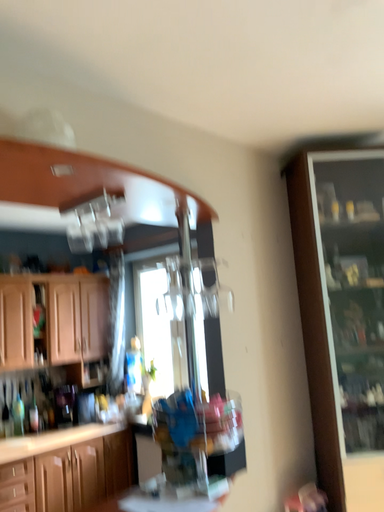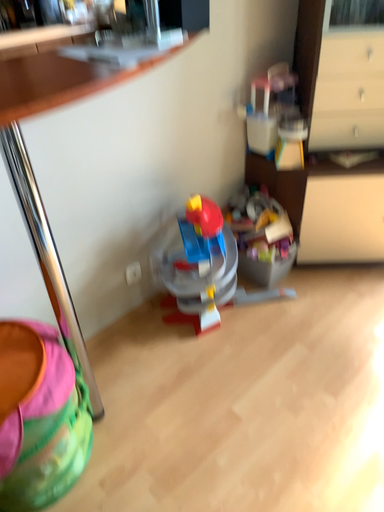
Question: How did the camera likely rotate when shooting the video?

Choices:
 (A) rotated downward
 (B) rotated upward

Answer: (A)